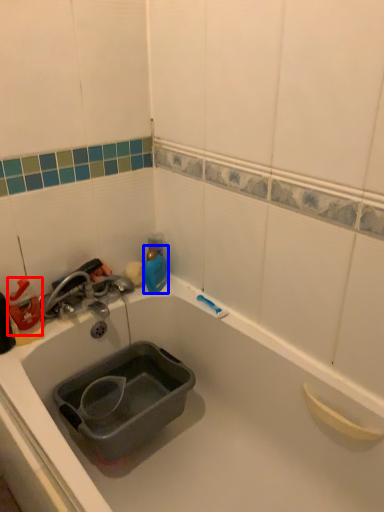
Question: Which object appears farthest to the camera in this image, cleaning product (highlighted by a red box) or bottle (highlighted by a blue box)?

Choices:
 (A) cleaning product
 (B) bottle

Answer: (B)